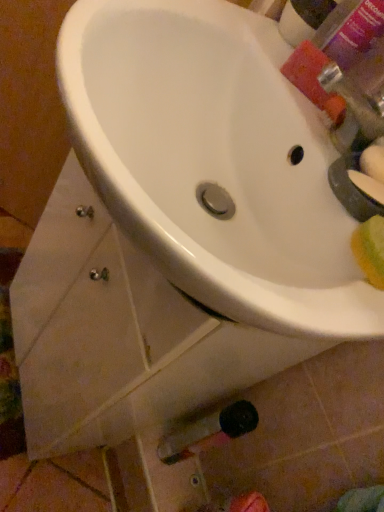
Image resolution: width=384 pixels, height=512 pixels. What do you see at coordinates (214, 161) in the screenshot?
I see `white glossy sink at center` at bounding box center [214, 161].

The width and height of the screenshot is (384, 512). I want to click on white glossy sink at center, so click(x=214, y=161).

The image size is (384, 512). What do you see at coordinates (367, 186) in the screenshot? I see `green matte soap at right` at bounding box center [367, 186].

This screenshot has width=384, height=512. What do you see at coordinates (350, 30) in the screenshot?
I see `pink matte bottle at upper right` at bounding box center [350, 30].

This screenshot has height=512, width=384. Find the location of `white glossy sink at center`. white glossy sink at center is located at coordinates (214, 161).

Would you say white glossy sink at center contains pink matte bottle at upper right?

Definitely not — pink matte bottle at upper right is not inside white glossy sink at center.

Which of these two, white glossy sink at center or pink matte bottle at upper right, is wider?

white glossy sink at center is wider.

Is white glossy sink at center to the left of pink matte bottle at upper right from the viewer's perspective?

Correct, you'll find white glossy sink at center to the left of pink matte bottle at upper right.

Is green matte soap at right positioned beyond the bounds of white glossy sink at center?

No, green matte soap at right is inside white glossy sink at center's boundary.

From a real-world perspective, does green matte soap at right stand above white glossy sink at center?

Correct, in the physical world, green matte soap at right is higher than white glossy sink at center.

Considering the relative positions of green matte soap at right and white glossy sink at center in the image provided, is green matte soap at right in front of white glossy sink at center?

No.

Which of these two, green matte soap at right or white glossy sink at center, is bigger?

white glossy sink at center is bigger.

Is pink matte bottle at upper right next to white glossy sink at center?

There is a gap between pink matte bottle at upper right and white glossy sink at center.

Is pink matte bottle at upper right spatially inside white glossy sink at center, or outside of it?

pink matte bottle at upper right is outside white glossy sink at center.

Who is smaller, pink matte bottle at upper right or white glossy sink at center?

pink matte bottle at upper right is smaller.

Is pink matte bottle at upper right positioned with its back to green matte soap at right?

No, green matte soap at right is not at the back of pink matte bottle at upper right.

Which of these two, pink matte bottle at upper right or green matte soap at right, is thinner?

green matte soap at right.

From the image's perspective, between pink matte bottle at upper right and green matte soap at right, which one is located above?

pink matte bottle at upper right appears higher in the image.

How many degrees apart are the facing directions of white glossy sink at center and green matte soap at right?

The angle between the facing direction of white glossy sink at center and the facing direction of green matte soap at right is 1.45 degrees.

From the image's perspective, is white glossy sink at center located above or below green matte soap at right?

white glossy sink at center is situated higher than green matte soap at right in the image.

From a real-world perspective, is white glossy sink at center under green matte soap at right?

Yes.

Is green matte soap at right at the back of white glossy sink at center?

No, white glossy sink at center is not facing away from green matte soap at right.

From a real-world perspective, which object rests below the other?

In real-world perspective, green matte soap at right is lower.

Find the location of a particular element. The image size is (384, 512). soap in front of the pink matte bottle at upper right is located at coordinates (367, 186).

Considering the positions of objects green matte soap at right and pink matte bottle at upper right in the image provided, who is more to the right, green matte soap at right or pink matte bottle at upper right?

From the viewer's perspective, green matte soap at right appears more on the right side.

Image resolution: width=384 pixels, height=512 pixels. I want to click on mouthwash on the right of white glossy sink at center, so click(x=350, y=30).

Locate an element on the screen. This screenshot has width=384, height=512. soap positioned vertically above the white glossy sink at center (from a real-world perspective) is located at coordinates (367, 186).

When comparing their distances from white glossy sink at center, does pink matte bottle at upper right or green matte soap at right seem further?

Among the two, pink matte bottle at upper right is located further to white glossy sink at center.

Looking at the image, which one is located further to pink matte bottle at upper right, green matte soap at right or white glossy sink at center?

green matte soap at right is positioned further to the anchor pink matte bottle at upper right.

From the image, which object appears to be farther from green matte soap at right, white glossy sink at center or pink matte bottle at upper right?

pink matte bottle at upper right is positioned further to the anchor green matte soap at right.

When comparing their distances from green matte soap at right, does pink matte bottle at upper right or white glossy sink at center seem closer?

white glossy sink at center is positioned closer to the anchor green matte soap at right.

Looking at the image, which one is located closer to white glossy sink at center, green matte soap at right or pink matte bottle at upper right?

green matte soap at right lies closer to white glossy sink at center than the other object.

Which object lies nearer to the anchor point pink matte bottle at upper right, white glossy sink at center or green matte soap at right?

white glossy sink at center.

This screenshot has height=512, width=384. I want to click on sink that lies between pink matte bottle at upper right and green matte soap at right from top to bottom, so click(x=214, y=161).